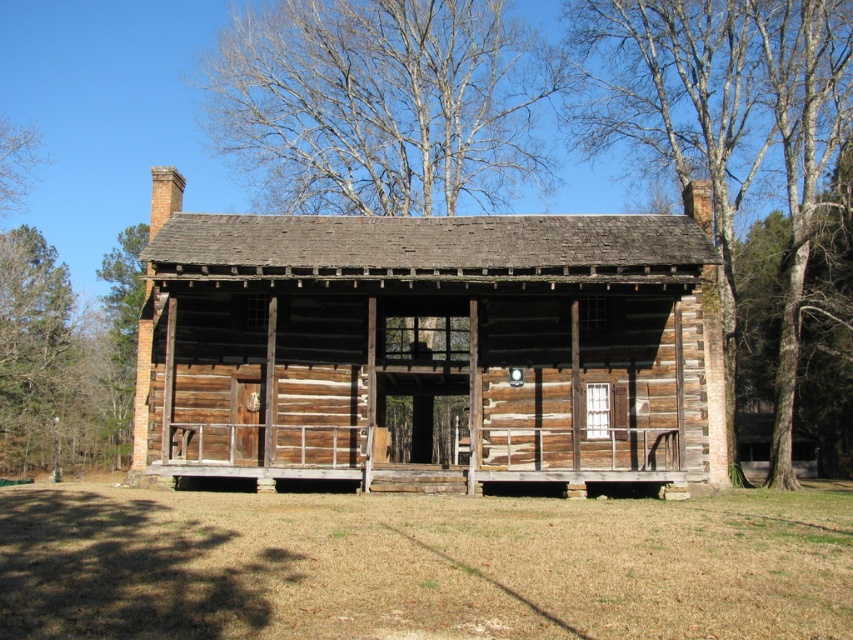
Between brown rough bark tree at right and bare branches at upper left, which one appears on the left side from the viewer's perspective?

From the viewer's perspective, bare branches at upper left appears more on the left side.

Describe the element at coordinates (726, 124) in the screenshot. I see `brown rough bark tree at right` at that location.

Looking at this image, who is more forward, (685, 51) or (33, 152)?

Point (685, 51) is more forward.

I want to click on brown rough bark tree at right, so click(x=726, y=124).

Who is more distant from viewer, (543, 49) or (289, 472)?

The point (543, 49) is more distant.

Which is more to the right, bare wood tree at upper center or weathered wood porch at center?

Positioned to the right is weathered wood porch at center.

Measure the distance between bare wood tree at upper center and camera.

bare wood tree at upper center is 58.41 meters away from camera.

This screenshot has height=640, width=853. I want to click on bare wood tree at upper center, so click(x=379, y=104).

Is weathered wood log cabin at center smaller than brown rough bark tree at right?

Yes, weathered wood log cabin at center is smaller than brown rough bark tree at right.

This screenshot has height=640, width=853. What do you see at coordinates (428, 348) in the screenshot? I see `weathered wood log cabin at center` at bounding box center [428, 348].

Is point (247, 388) farther from viewer compared to point (805, 246)?

No, it is in front of (805, 246).

Identify the location of weathered wood log cabin at center. (428, 348).